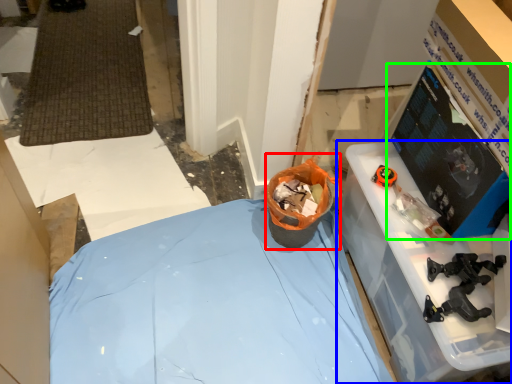
Question: Which is farther away from garbage (highlighted by a red box)? furniture (highlighted by a blue box) or computer monitor (highlighted by a green box)?

Choices:
 (A) furniture
 (B) computer monitor

Answer: (B)